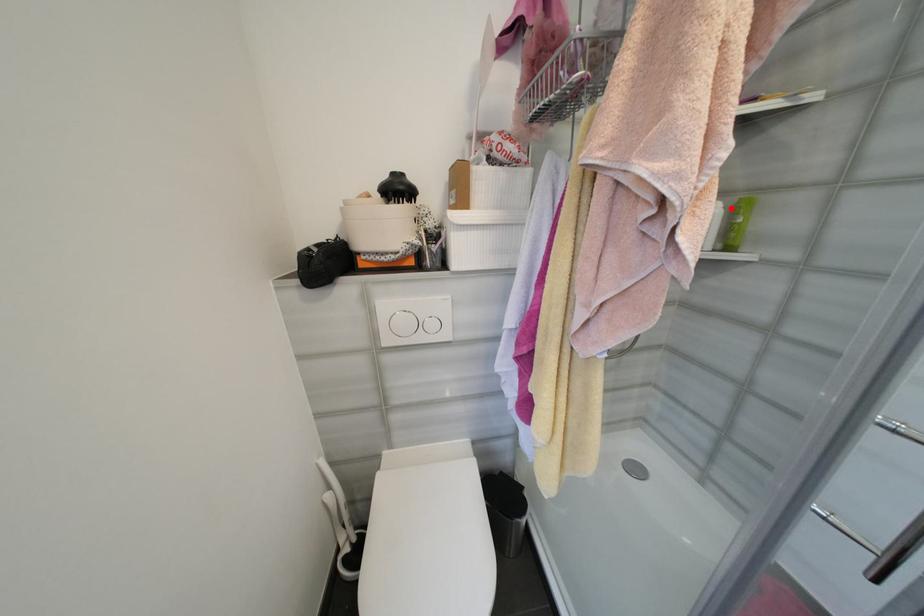
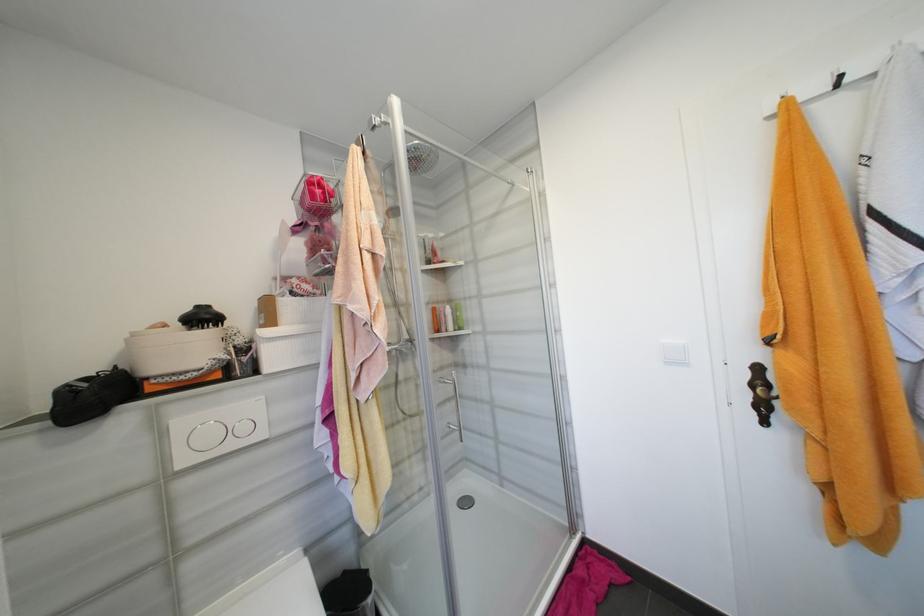
Find the pixel in the second image that matches the highlighted location in the first image.

(457, 309)